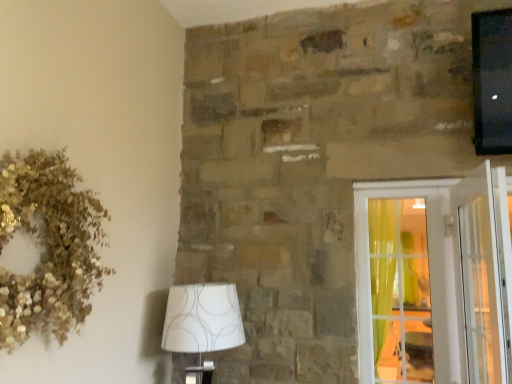
Question: Considering the positions of gold glitter wreath at upper left and clear glass door at right in the image, is gold glitter wreath at upper left taller or shorter than clear glass door at right?

Choices:
 (A) tall
 (B) short

Answer: (B)

Question: Considering the positions of gold glitter wreath at upper left and clear glass door at right in the image, is gold glitter wreath at upper left bigger or smaller than clear glass door at right?

Choices:
 (A) big
 (B) small

Answer: (A)

Question: Which of these objects is positioned farthest from the gold glitter wreath at upper left?

Choices:
 (A) clear glass door at right
 (B) clear glass screen door at right
 (C) white fabric lampshade at lower left

Answer: (B)

Question: Based on their relative distances, which object is nearer to the white fabric lampshade at lower left?

Choices:
 (A) clear glass door at right
 (B) gold glitter wreath at upper left
 (C) clear glass screen door at right

Answer: (B)